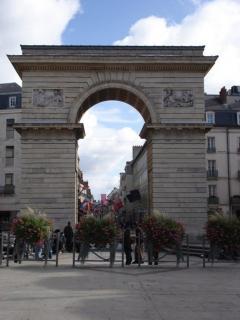
Find the location of `designs on arch`. designs on arch is located at coordinates click(x=181, y=96), click(x=48, y=96).